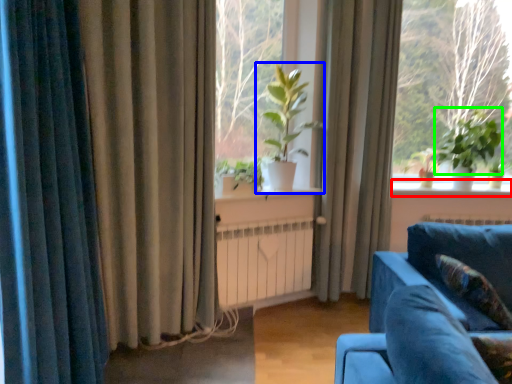
Question: Which object is the closest to the window sill (highlighted by a red box)? Choose among these: houseplant (highlighted by a blue box) or plant (highlighted by a green box).

Choices:
 (A) houseplant
 (B) plant

Answer: (B)